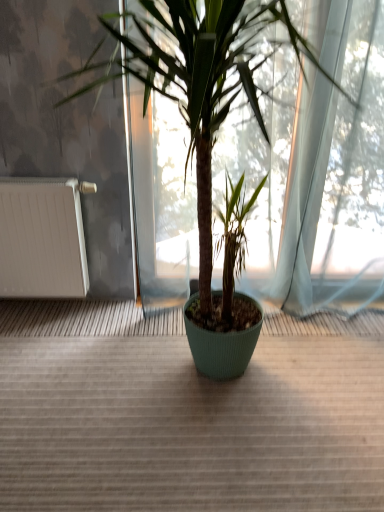
I want to click on free area in between green ribbed pot at center and white matte radiator at left, so click(x=53, y=354).